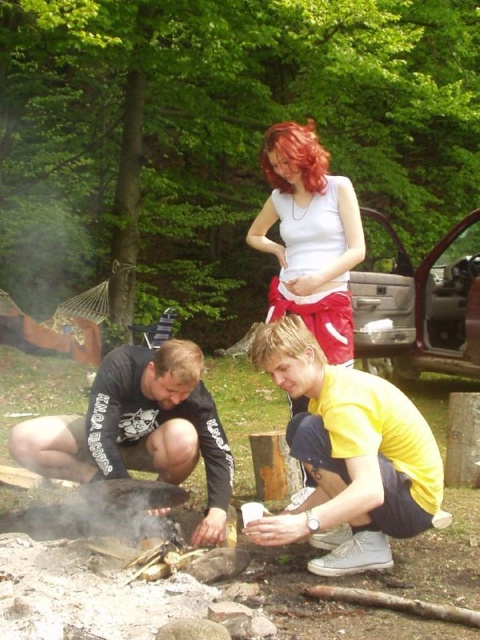
Question: Is yellow matte shirt at lower center below white matte tank top at center?

Choices:
 (A) no
 (B) yes

Answer: (B)

Question: Can you confirm if yellow matte shirt at lower center is positioned to the left of white matte tank top at center?

Choices:
 (A) no
 (B) yes

Answer: (A)

Question: Which object is farther from the camera taking this photo?

Choices:
 (A) yellow matte shirt at lower center
 (B) white matte tank top at center
 (C) black cotton shirt at center

Answer: (B)

Question: Which of the following is the closest to the observer?

Choices:
 (A) (404, 440)
 (B) (331, 333)
 (C) (183, 449)

Answer: (A)

Question: Which object is the farthest from the yellow matte shirt at lower center?

Choices:
 (A) white matte tank top at center
 (B) black cotton shirt at center

Answer: (A)

Question: Is yellow matte shirt at lower center smaller than black cotton shirt at center?

Choices:
 (A) yes
 (B) no

Answer: (B)